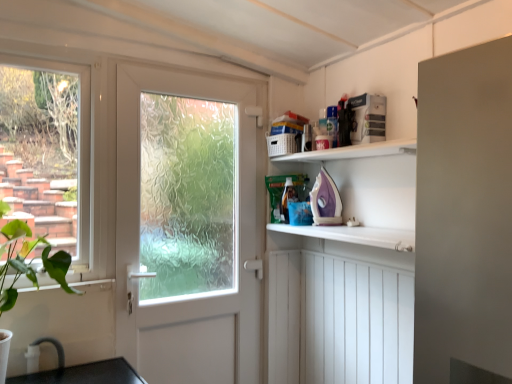
Find the location of a particular element. This screenshot has height=384, width=512. blank space situated above clear glass window at left (from a real-world perspective) is located at coordinates (44, 45).